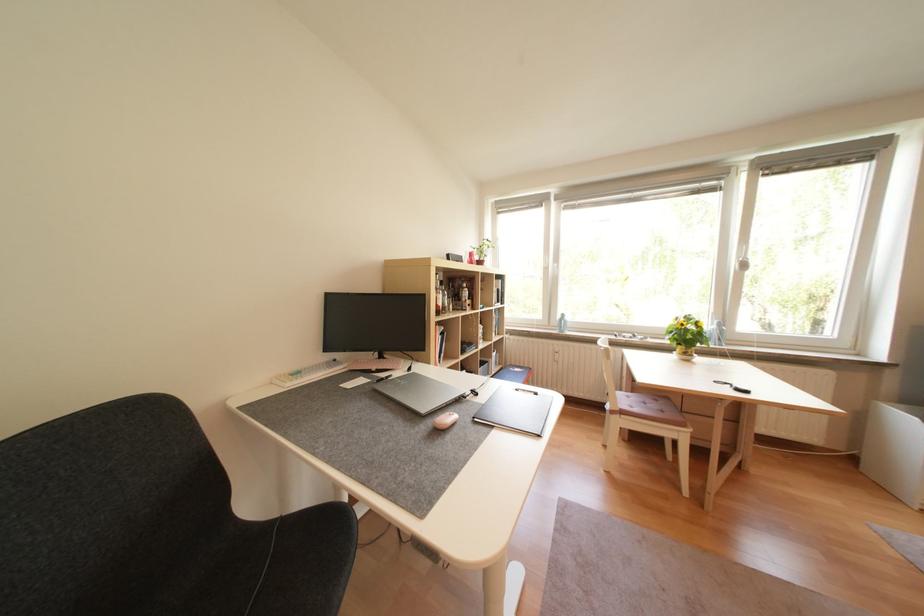
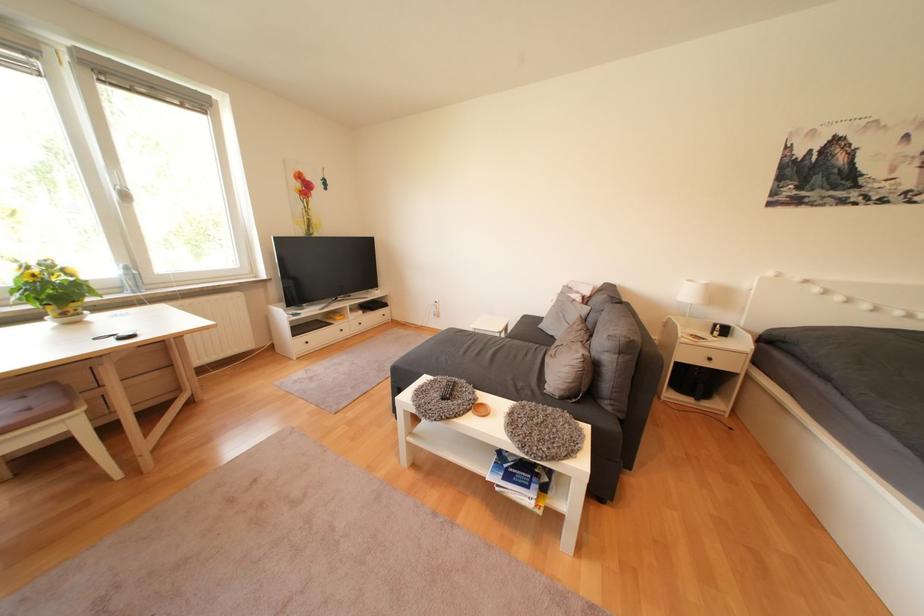
First-person continuous shooting, in which direction is the camera rotating?

The camera's rotation is toward right-down.